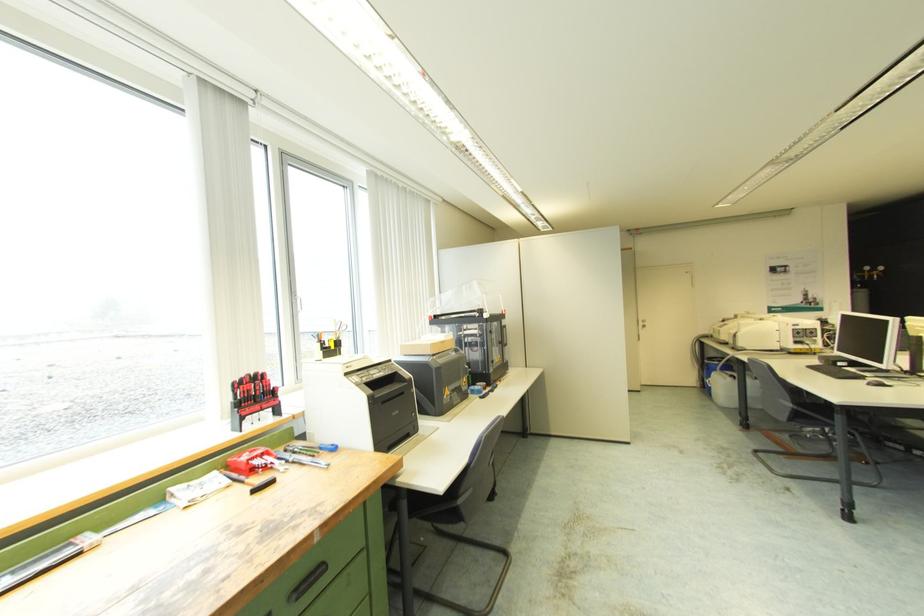
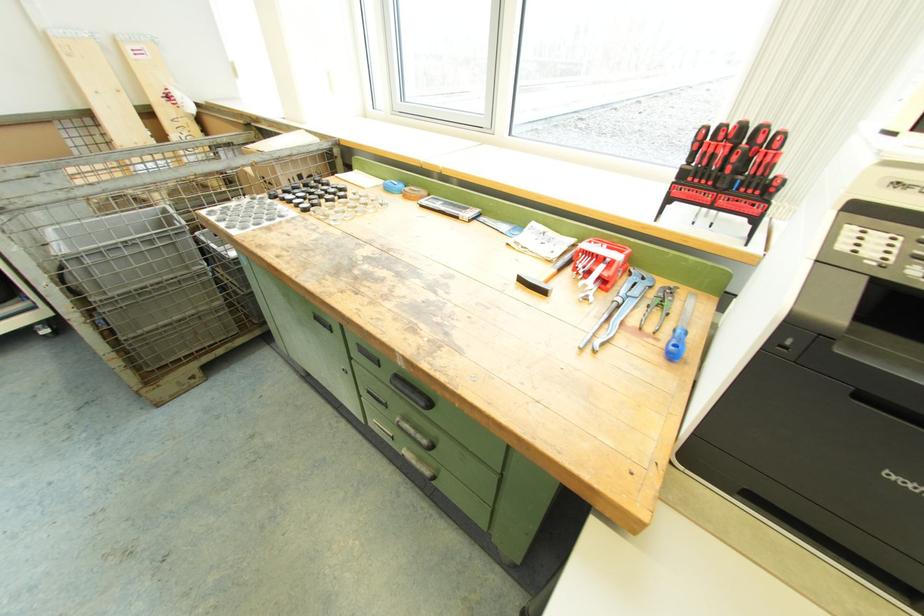
Locate, in the second image, the point that corresponds to [386,403] in the first image.

(867, 398)